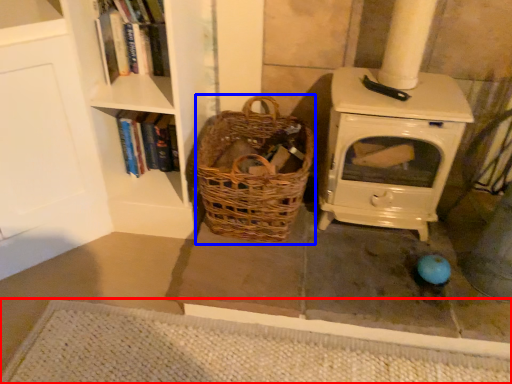
Question: Which object appears farthest to the camera in this image, doormat (highlighted by a red box) or basket (highlighted by a blue box)?

Choices:
 (A) doormat
 (B) basket

Answer: (B)